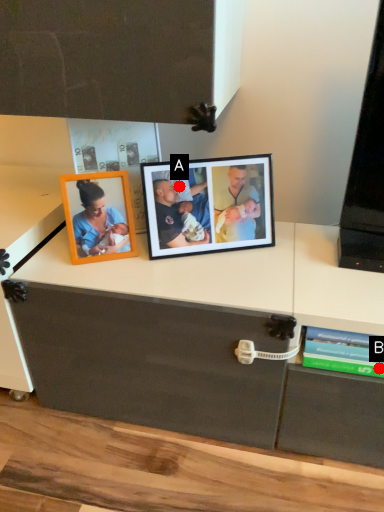
Question: Two points are circled on the image, labeled by A and B beside each circle. Which point is farther from the camera taking this photo?

Choices:
 (A) A is further
 (B) B is further

Answer: (A)